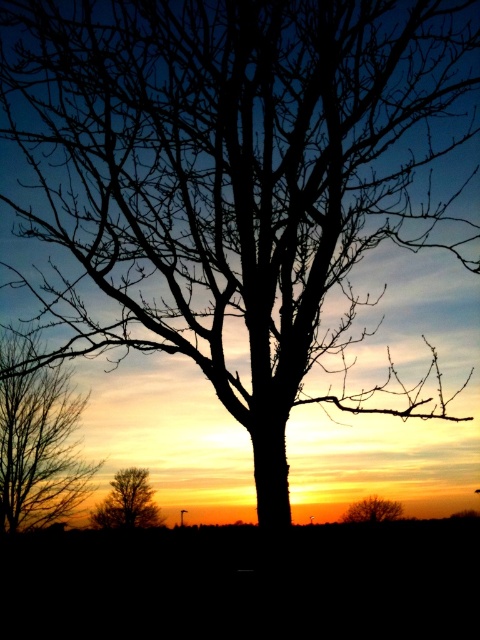
Question: Which point is closer to the camera?

Choices:
 (A) brown textured tree at lower left
 (B) silhouette bare tree at left

Answer: (B)

Question: Is silhouette bare tree at left positioned in front of brown textured tree at lower left?

Choices:
 (A) no
 (B) yes

Answer: (B)

Question: Observing the image, what is the correct spatial positioning of silhouette bare tree at left in reference to brown textured tree at lower right?

Choices:
 (A) above
 (B) below

Answer: (A)

Question: Which of the following is the farthest from the observer?

Choices:
 (A) brown textured tree at lower left
 (B) silhouette bare tree at left

Answer: (A)

Question: Which object is farther from the camera taking this photo?

Choices:
 (A) brown textured tree at lower left
 (B) brown textured tree at lower right

Answer: (A)

Question: Observing the image, what is the correct spatial positioning of silhouette bare tree at left in reference to brown textured tree at lower left?

Choices:
 (A) left
 (B) right

Answer: (A)